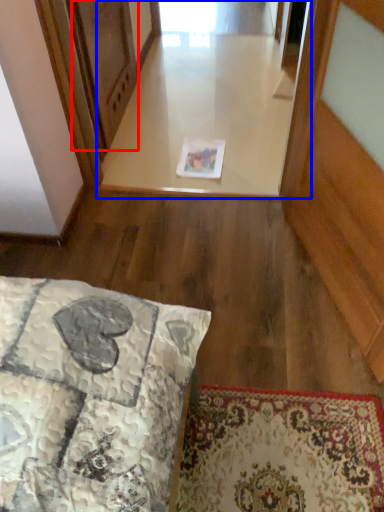
Question: Which object appears farthest to the camera in this image, screen door (highlighted by a red box) or window (highlighted by a blue box)?

Choices:
 (A) screen door
 (B) window

Answer: (B)